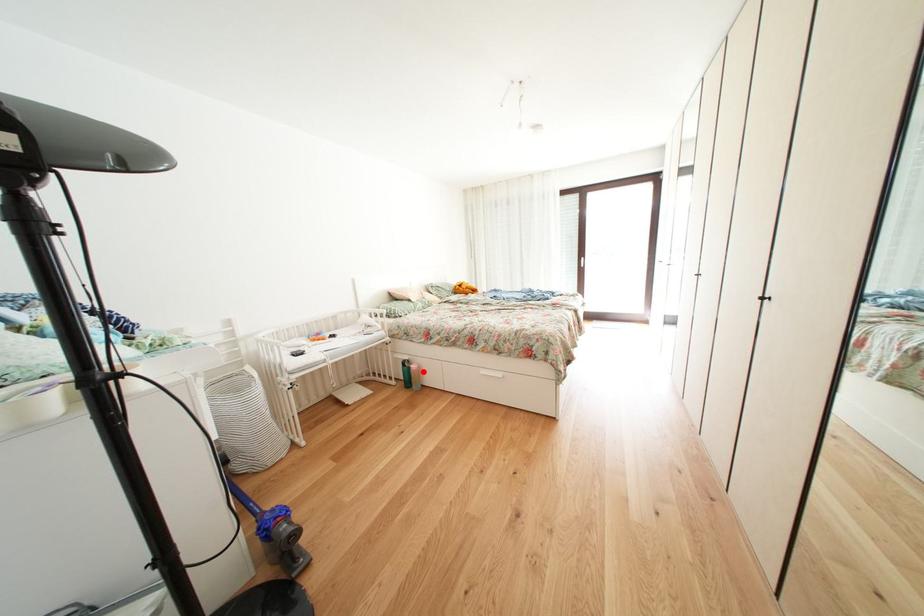
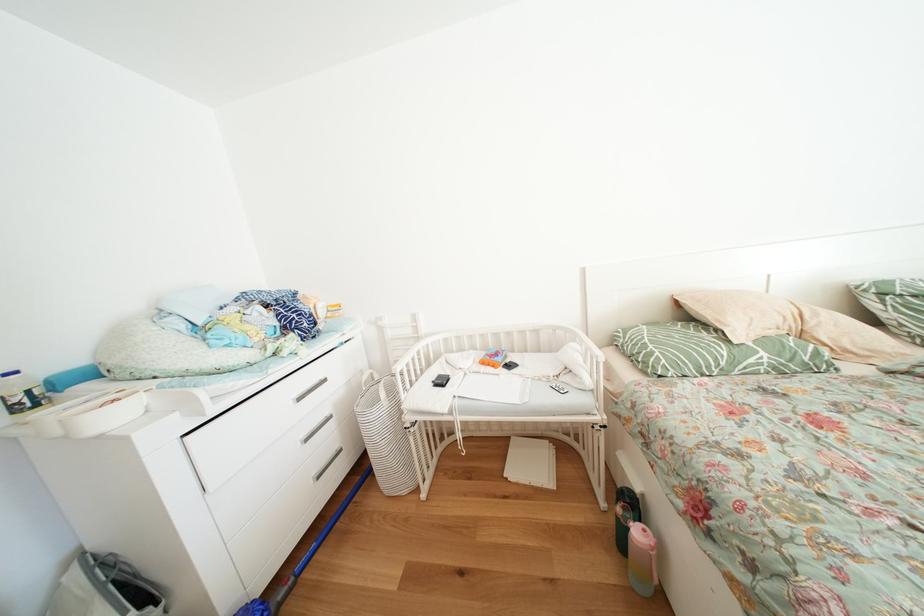
Question: A red point is marked in image1. In image2, is the corresponding 3D point closer to the camera or farther? Reply with the corresponding letter.

Choices:
 (A) The corresponding 3D point is closer.
 (B) The corresponding 3D point is farther.

Answer: (A)